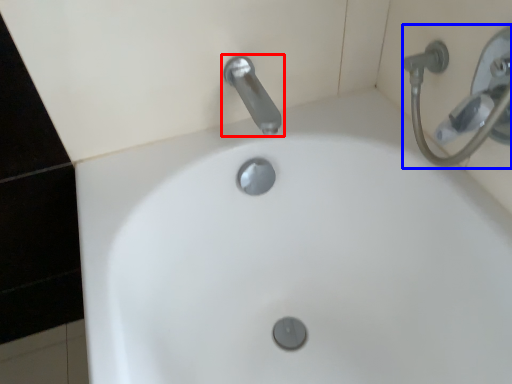
Question: Which of the following is the closest to the observer, tap (highlighted by a red box) or shower (highlighted by a blue box)?

Choices:
 (A) tap
 (B) shower

Answer: (B)